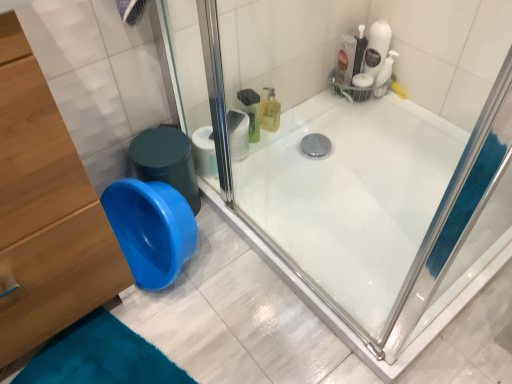
Describe the element at coordinates (205, 152) in the screenshot. The image size is (512, 384). I see `white matte toilet paper at upper center` at that location.

Where is `wooden dresser at left`? wooden dresser at left is located at coordinates (45, 211).

Describe the element at coordinates (166, 161) in the screenshot. The height and width of the screenshot is (384, 512). I see `blue plastic potty at lower left` at that location.

The image size is (512, 384). Find the location of `white matte toilet paper at upper center`. white matte toilet paper at upper center is located at coordinates (205, 152).

Is wooden dresser at left beside white matte toilet paper at upper center?

No, wooden dresser at left is not beside white matte toilet paper at upper center.

Between wooden dresser at left and white matte toilet paper at upper center, which one appears on the left side from the viewer's perspective?

Positioned to the left is wooden dresser at left.

In the image, is wooden dresser at left positioned in front of or behind white matte toilet paper at upper center?

Clearly, wooden dresser at left is in front of white matte toilet paper at upper center.

Which is in front, point (33, 290) or point (198, 134)?

Positioned in front is point (33, 290).

Is white matte toilet paper at upper center smaller than wooden dresser at left?

Correct, white matte toilet paper at upper center occupies less space than wooden dresser at left.

What's the angular difference between white matte toilet paper at upper center and wooden dresser at left's facing directions?

4.14 degrees.

Is white matte toilet paper at upper center looking in the opposite direction of wooden dresser at left?

No, white matte toilet paper at upper center's orientation is not away from wooden dresser at left.

Considering the sizes of objects white matte toilet paper at upper center and wooden dresser at left in the image provided, who is thinner, white matte toilet paper at upper center or wooden dresser at left?

Thinner between the two is white matte toilet paper at upper center.

From the image's perspective, is blue plastic potty at lower left above or below wooden dresser at left?

blue plastic potty at lower left is above wooden dresser at left.

Consider the image. Is blue plastic potty at lower left turned away from wooden dresser at left?

That's not correct — blue plastic potty at lower left is not looking away from wooden dresser at left.

Can you tell me how much blue plastic potty at lower left and wooden dresser at left differ in facing direction?

There is a 2.87-degree angle between the facing directions of blue plastic potty at lower left and wooden dresser at left.

Is blue plastic potty at lower left not near white matte toilet paper at upper center?

No.

Is blue plastic potty at lower left thinner than white matte toilet paper at upper center?

No, blue plastic potty at lower left is not thinner than white matte toilet paper at upper center.

Is white matte toilet paper at upper center a part of blue plastic potty at lower left?

No, blue plastic potty at lower left does not contain white matte toilet paper at upper center.

In the scene shown: From a real-world perspective, between blue plastic potty at lower left and white matte toilet paper at upper center, who is vertically lower?

white matte toilet paper at upper center, from a real-world perspective.

Image resolution: width=512 pixels, height=384 pixels. I want to click on potty to the left of white matte toilet paper at upper center, so click(166, 161).

Can you confirm if white matte toilet paper at upper center is thinner than blue plastic potty at lower left?

Yes, white matte toilet paper at upper center is thinner than blue plastic potty at lower left.

Is the position of white matte toilet paper at upper center less distant than that of blue plastic potty at lower left?

No, white matte toilet paper at upper center is further to the viewer.

From the image's perspective, which is above, white matte toilet paper at upper center or blue plastic potty at lower left?

white matte toilet paper at upper center is shown above in the image.

Is wooden dresser at left completely or partially outside of blue plastic potty at lower left?

Yes.

From the image's perspective, is wooden dresser at left positioned above or below blue plastic potty at lower left?

Based on their image positions, wooden dresser at left is located beneath blue plastic potty at lower left.

Is wooden dresser at left to the right of blue plastic potty at lower left from the viewer's perspective?

No.

Between wooden dresser at left and blue plastic potty at lower left, which one is positioned behind?

blue plastic potty at lower left.

Locate an element on the screen. This screenshot has width=512, height=384. dresser lying in front of the white matte toilet paper at upper center is located at coordinates (45, 211).

This screenshot has height=384, width=512. I want to click on dresser on the left of white matte toilet paper at upper center, so click(45, 211).

When comparing their distances from white matte toilet paper at upper center, does wooden dresser at left or blue plastic potty at lower left seem closer?

blue plastic potty at lower left.

From the picture: Based on their spatial positions, is white matte toilet paper at upper center or blue plastic potty at lower left closer to wooden dresser at left?

Among the two, blue plastic potty at lower left is located nearer to wooden dresser at left.

Based on the photo, considering their positions, is blue plastic potty at lower left positioned further to white matte toilet paper at upper center than wooden dresser at left?

wooden dresser at left is further to white matte toilet paper at upper center.

Looking at the image, which one is located closer to blue plastic potty at lower left, wooden dresser at left or white matte toilet paper at upper center?

Based on the image, white matte toilet paper at upper center appears to be nearer to blue plastic potty at lower left.

Estimate the real-world distances between objects in this image. Which object is closer to wooden dresser at left, blue plastic potty at lower left or white matte toilet paper at upper center?

blue plastic potty at lower left lies closer to wooden dresser at left than the other object.

Estimate the real-world distances between objects in this image. Which object is closer to blue plastic potty at lower left, white matte toilet paper at upper center or wooden dresser at left?

Based on the image, white matte toilet paper at upper center appears to be nearer to blue plastic potty at lower left.

Identify the location of potty positioned between wooden dresser at left and white matte toilet paper at upper center from near to far. (166, 161).